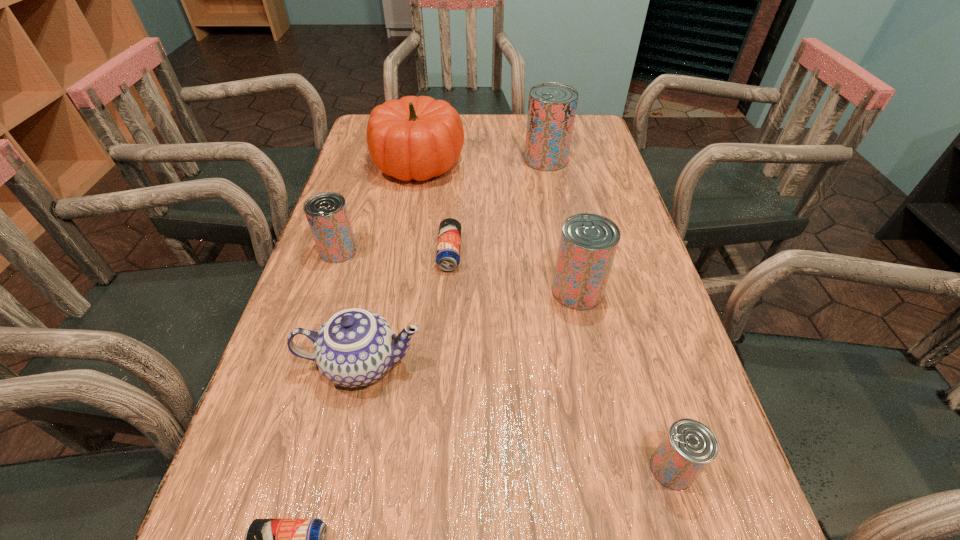
The height and width of the screenshot is (540, 960). I want to click on red beer can object that ranks as the closest to the tallest beer can, so click(588, 242).

At what (x,y) coordinates should I click in order to perform the action: click on red beer can that is the fourth nearest to the nearer blue beer can. Please return your answer as a coordinate pair (x, y). Image resolution: width=960 pixels, height=540 pixels. Looking at the image, I should click on (552, 106).

I want to click on free space in the image that satisfies the following two spatial constraints: 1. on the front side of the pumpkin; 2. on the left side of the rightmost object, so click(364, 469).

Identify the location of free space that satisfies the following two spatial constraints: 1. on the front side of the second tallest beer can; 2. on the right side of the third biggest red beer can. (325, 291).